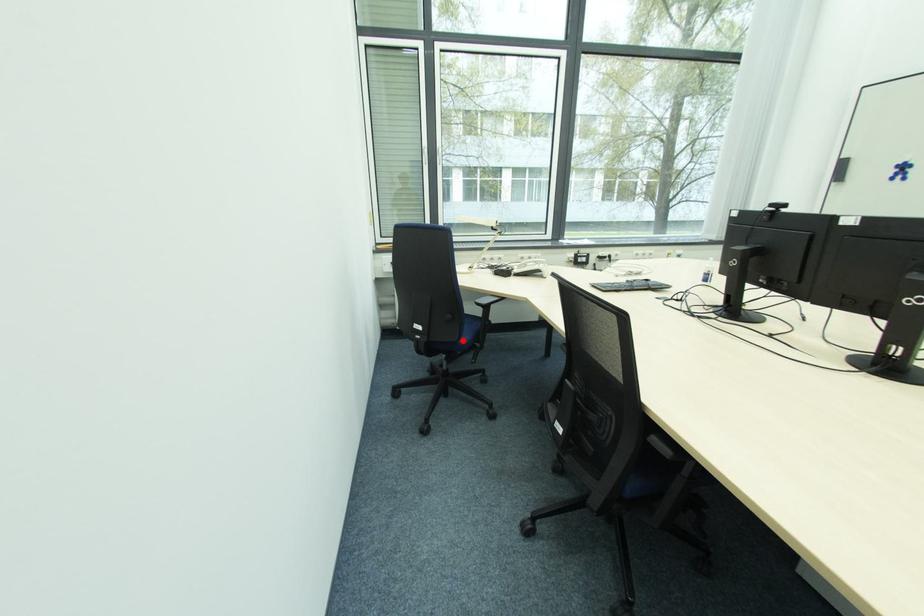
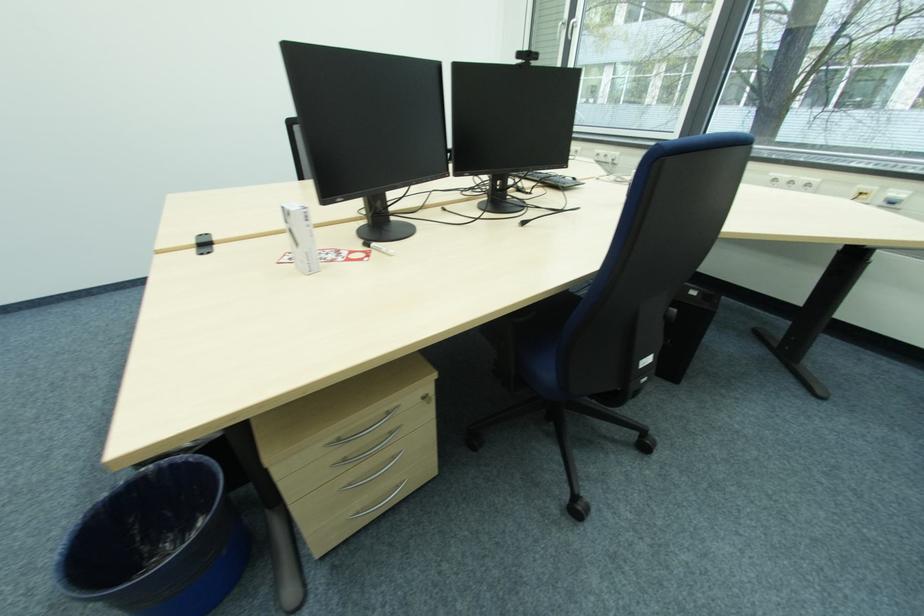
Question: I am providing you with two images of the same scene from different viewpoints. A red point is marked on the first image. Is the red point's position out of view in image 2?

Choices:
 (A) Yes
 (B) No

Answer: (A)